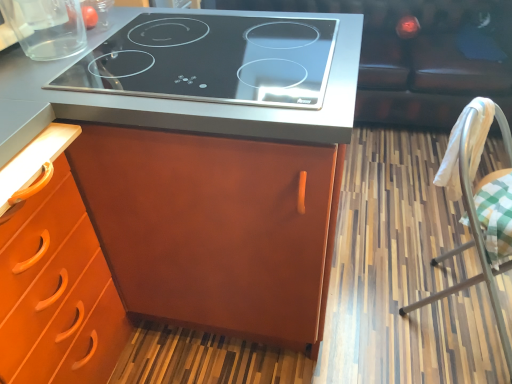
Question: Is transparent glass container at upper left closer to camera compared to leather couch at upper right?

Choices:
 (A) no
 (B) yes

Answer: (B)

Question: Is transparent glass container at upper left aimed at leather couch at upper right?

Choices:
 (A) yes
 (B) no

Answer: (B)

Question: Is transparent glass container at upper left wider than leather couch at upper right?

Choices:
 (A) yes
 (B) no

Answer: (B)

Question: Does transparent glass container at upper left appear on the right side of leather couch at upper right?

Choices:
 (A) no
 (B) yes

Answer: (A)

Question: From a real-world perspective, is transparent glass container at upper left below leather couch at upper right?

Choices:
 (A) no
 (B) yes

Answer: (A)

Question: From a real-world perspective, relative to matte wood cabinet at center, is white fabric-covered chair at right vertically above or below?

Choices:
 (A) above
 (B) below

Answer: (B)

Question: Based on their positions, is white fabric-covered chair at right located to the left or right of matte wood cabinet at center?

Choices:
 (A) right
 (B) left

Answer: (A)

Question: Based on their sizes in the image, would you say white fabric-covered chair at right is bigger or smaller than matte wood cabinet at center?

Choices:
 (A) small
 (B) big

Answer: (A)

Question: Considering the positions of white fabric-covered chair at right and matte wood cabinet at center in the image, is white fabric-covered chair at right taller or shorter than matte wood cabinet at center?

Choices:
 (A) short
 (B) tall

Answer: (A)

Question: From a real-world perspective, is black glass cooktop at upper center physically located above or below transparent glass container at upper left?

Choices:
 (A) above
 (B) below

Answer: (B)

Question: Is black glass cooktop at upper center bigger or smaller than transparent glass container at upper left?

Choices:
 (A) big
 (B) small

Answer: (A)

Question: Relative to transparent glass container at upper left, is black glass cooktop at upper center in front or behind?

Choices:
 (A) behind
 (B) front

Answer: (B)

Question: From the image's perspective, is black glass cooktop at upper center above or below transparent glass container at upper left?

Choices:
 (A) above
 (B) below

Answer: (B)

Question: From a real-world perspective, relative to black glass cooktop at upper center, is white fabric-covered chair at right vertically above or below?

Choices:
 (A) below
 (B) above

Answer: (A)

Question: Based on their sizes in the image, would you say white fabric-covered chair at right is bigger or smaller than black glass cooktop at upper center?

Choices:
 (A) small
 (B) big

Answer: (B)